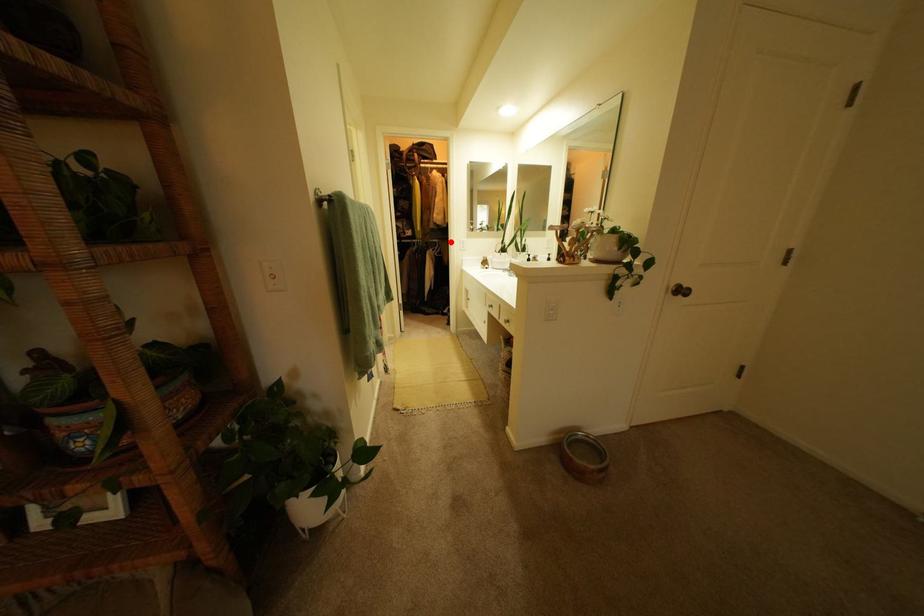
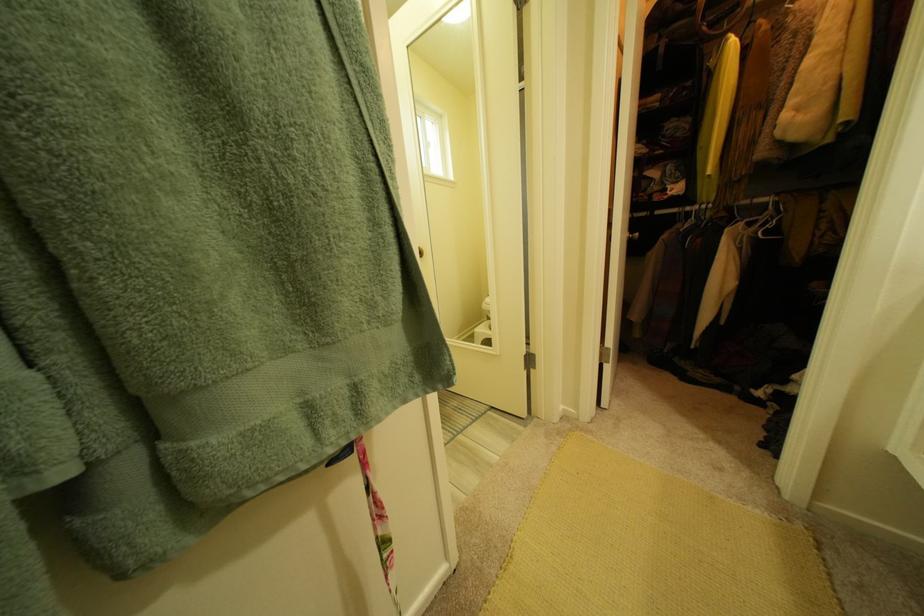
In the second image, find the point that corresponds to the highlighted location in the first image.

(777, 201)